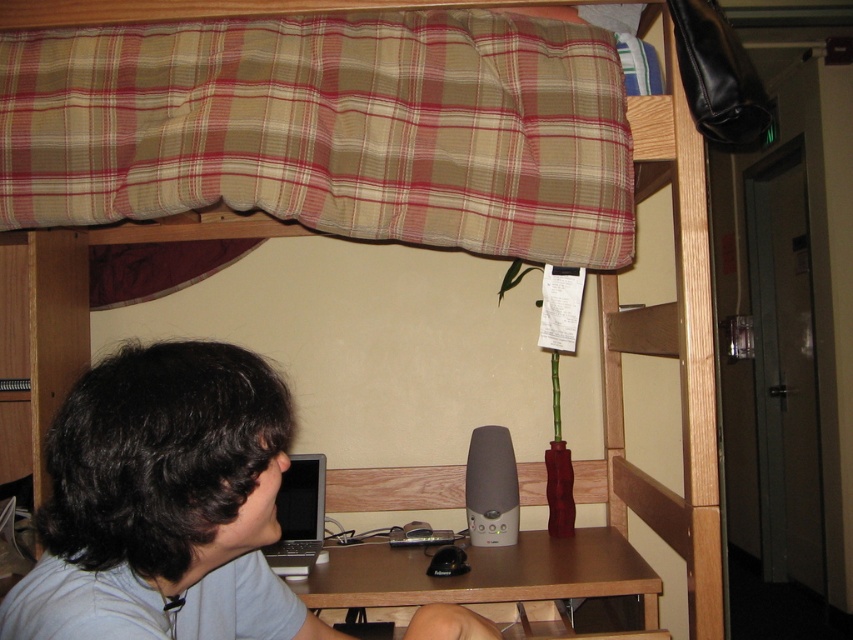
You are standing at point (294, 77) and want to reach the desk. Can you walk directly to the desk without moving around any objects?

The distance between point (294, 77) and the desk is 4.52 feet, so yes, you can walk directly to the desk without moving around any objects since there is enough space between them.

What is the 2D coordinate of the brown wooden table at lower center?

The brown wooden table at lower center is located at the 2D coordinate point of (485, 579).

From the picture: You are organizing a study session in the dorm room and need to place a large textbook on the available surfaces. Which surface, the plaid fabric curtain at upper center or the brown wooden table at lower center, can accommodate the textbook without folding it?

The brown wooden table at lower center can accommodate the textbook without folding it because it occupies more space than the plaid fabric curtain at upper center.